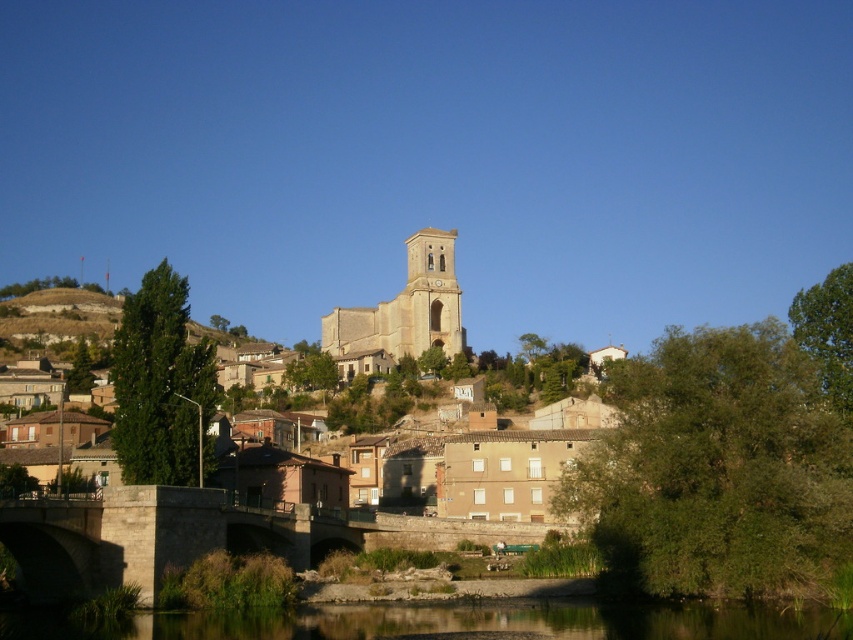
Question: Does light beige stone tower at center have a larger size compared to brown rocky hillside at left?

Choices:
 (A) no
 (B) yes

Answer: (A)

Question: Is stone bridge at lower center below brown rocky hillside at left?

Choices:
 (A) no
 (B) yes

Answer: (B)

Question: Which of the following is the closest to the observer?

Choices:
 (A) brown rocky hillside at left
 (B) clear water at lower center

Answer: (B)

Question: Based on their relative distances, which object is farther from the brown rocky hillside at left?

Choices:
 (A) light beige stone tower at center
 (B) clear water at lower center

Answer: (B)

Question: Does stone bridge at lower center have a lesser width compared to brown rocky hillside at left?

Choices:
 (A) no
 (B) yes

Answer: (B)

Question: Which point is closer to the camera?

Choices:
 (A) clear water at lower center
 (B) stone bridge at lower center

Answer: (A)